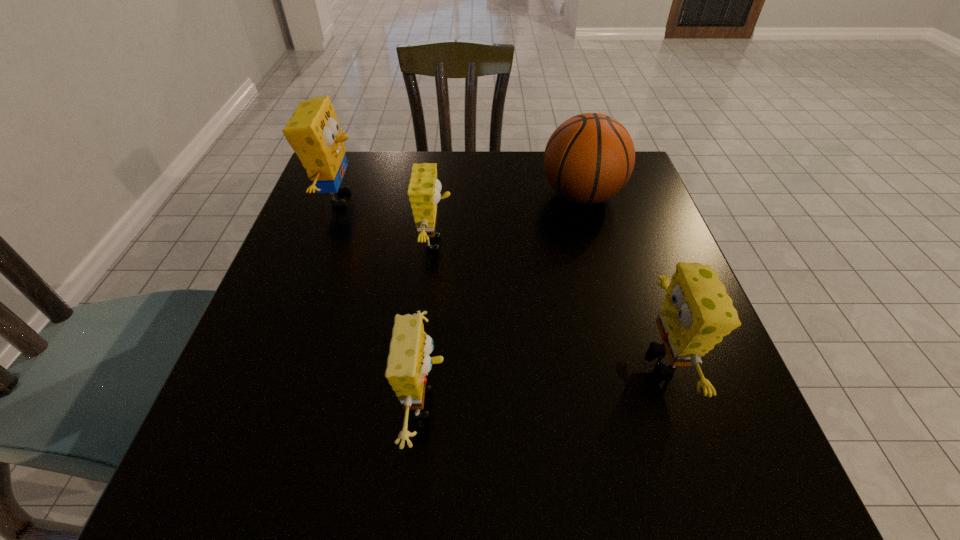
Find the location of a particular element. The image size is (960, 540). the leftmost sponge is located at coordinates (313, 132).

This screenshot has width=960, height=540. Identify the location of the tallest sponge. (313, 132).

The width and height of the screenshot is (960, 540). I want to click on basketball, so (589, 158).

Locate an element on the screen. the rightmost sponge is located at coordinates (696, 314).

This screenshot has width=960, height=540. Identify the location of vacant area located on the face of the tallest sponge. (386, 198).

The image size is (960, 540). Identify the location of free space located 0.260m on the left of the basketball. (439, 195).

Identify the location of vacant area situated 0.080m on the face of the rightmost sponge. (594, 360).

Image resolution: width=960 pixels, height=540 pixels. I want to click on vacant space located on the face of the rightmost sponge, so click(x=566, y=360).

Identify the location of vacant point located 0.360m on the face of the rightmost sponge. This screenshot has width=960, height=540. (437, 360).

Locate an element on the screen. The image size is (960, 540). sponge that is at the far edge is located at coordinates (313, 132).